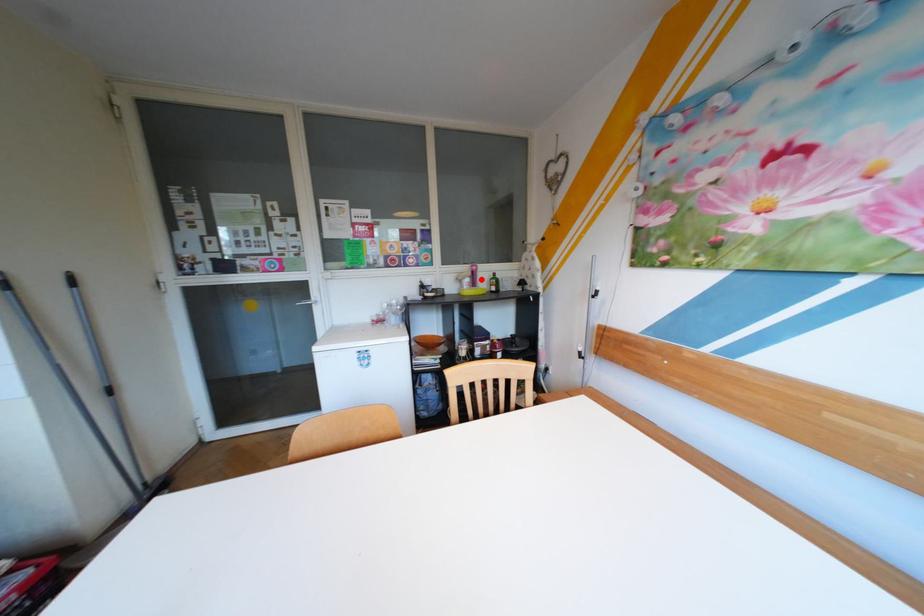
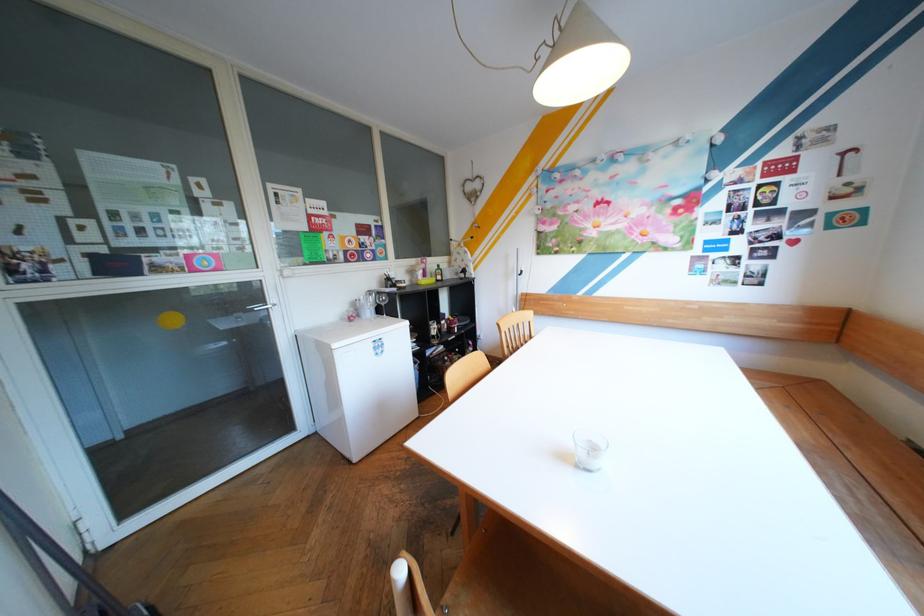
Where in the second image is the point corresponding to the highlighted location from the first image?

(434, 270)